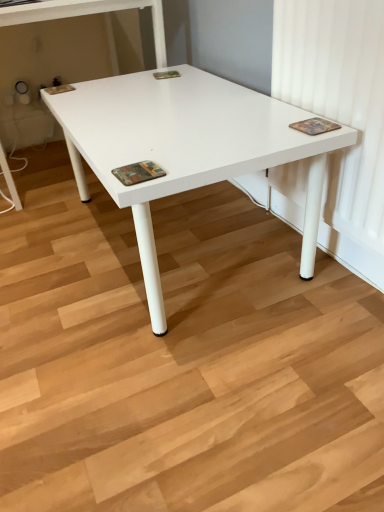
Where is `vacant area that is in front of white glossy computer desk at center`? vacant area that is in front of white glossy computer desk at center is located at coordinates (96, 234).